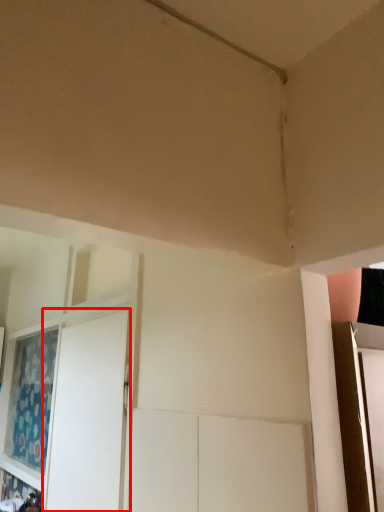
Question: From the image, what is the correct spatial relationship of screen door (annotated by the red box) in relation to curtain?

Choices:
 (A) right
 (B) left

Answer: (A)